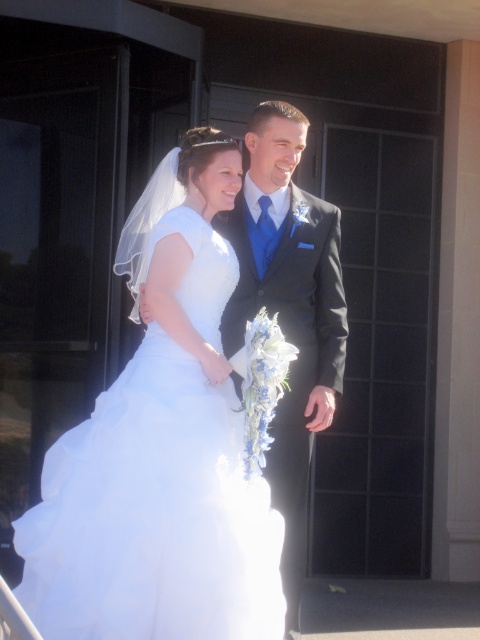
Question: Which object is closer to the camera taking this photo?

Choices:
 (A) shiny black suit at center
 (B) white satin dress at center

Answer: (B)

Question: Can you confirm if white satin dress at center is positioned above shiny black suit at center?

Choices:
 (A) yes
 (B) no

Answer: (B)

Question: Which object appears farthest from the camera in this image?

Choices:
 (A) shiny black suit at center
 (B) white satin dress at center

Answer: (A)

Question: Is white satin dress at center bigger than shiny black suit at center?

Choices:
 (A) yes
 (B) no

Answer: (A)

Question: Among these objects, which one is farthest from the camera?

Choices:
 (A) white satin dress at center
 (B) shiny black suit at center

Answer: (B)

Question: Considering the relative positions of white satin dress at center and shiny black suit at center in the image provided, where is white satin dress at center located with respect to shiny black suit at center?

Choices:
 (A) left
 (B) right

Answer: (A)